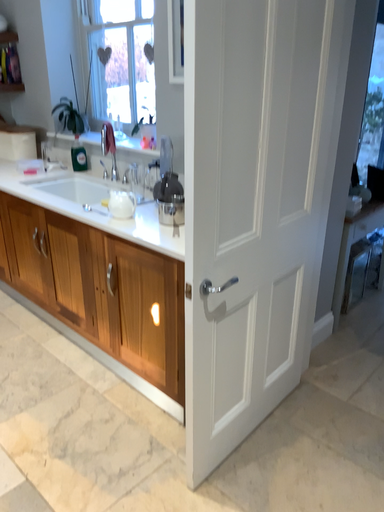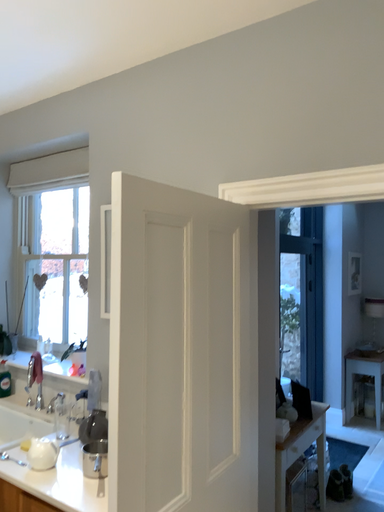
Question: How did the camera likely rotate when shooting the video?

Choices:
 (A) rotated right
 (B) rotated left

Answer: (A)